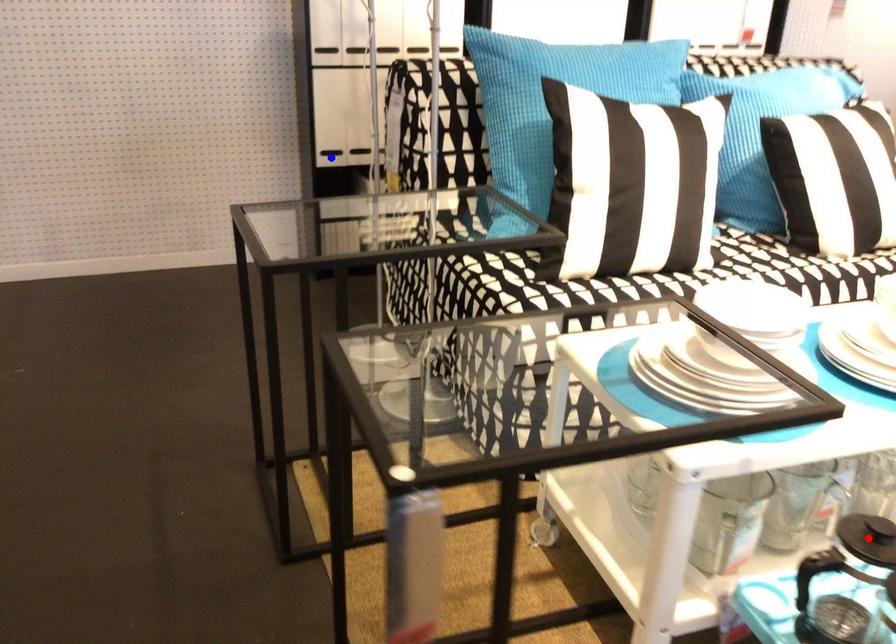
Question: Two points are marked on the image. Which point is closer to the camera?

Choices:
 (A) Blue point is closer.
 (B) Red point is closer.

Answer: (B)